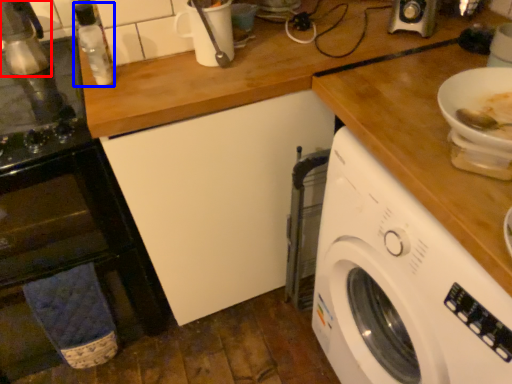
Question: Which object is further to the camera taking this photo, appliance (highlighted by a red box) or bottle (highlighted by a blue box)?

Choices:
 (A) appliance
 (B) bottle

Answer: (B)